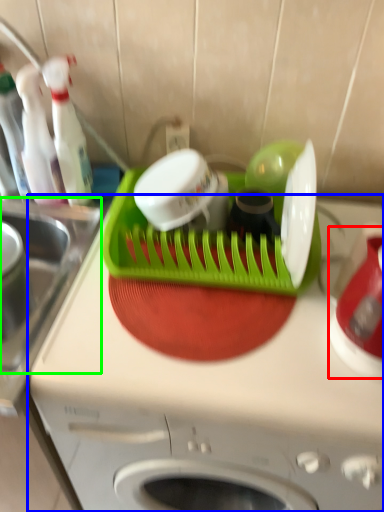
Question: Considering the real-world distances, which object is closest to appliance (highlighted by a red box)? home appliance (highlighted by a blue box) or sink (highlighted by a green box).

Choices:
 (A) home appliance
 (B) sink

Answer: (A)